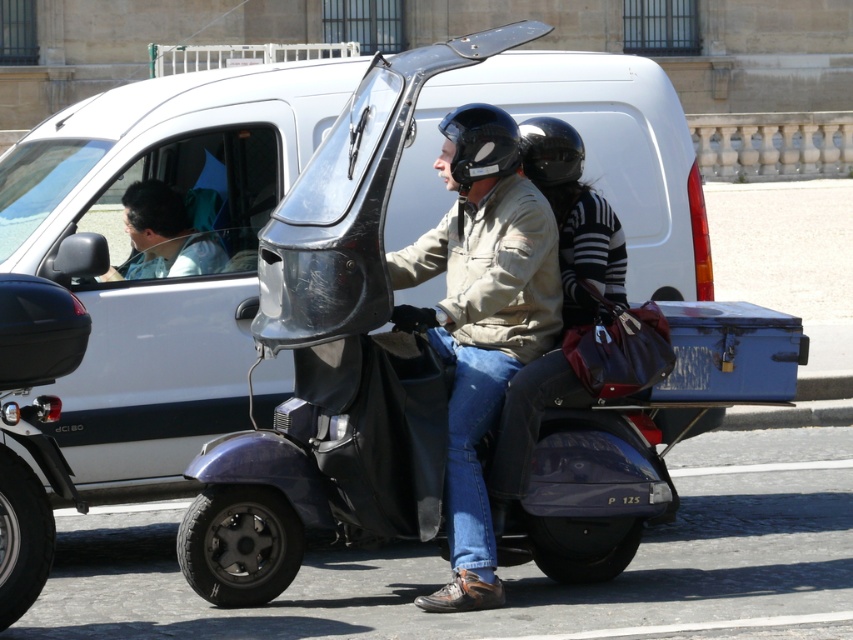
You are a delivery person who needs to find a matte khaki jacket in the image. According to the coordinates provided, where should you look to locate the matte khaki jacket at center?

The matte khaki jacket at center is located at point coordinates of [480,320].

You are standing at a distance and see the matte khaki jacket at center in the scene. Can you reach out and touch it without moving closer?

The matte khaki jacket at center is 8.37 meters away from the viewer, so you cannot reach it without moving closer.

You are a pedestrian observing the three wheeled scooter with the matte khaki jacket at center and the black matte helmet at center. Which object is taller?

The matte khaki jacket at center is taller than the black matte helmet at center.